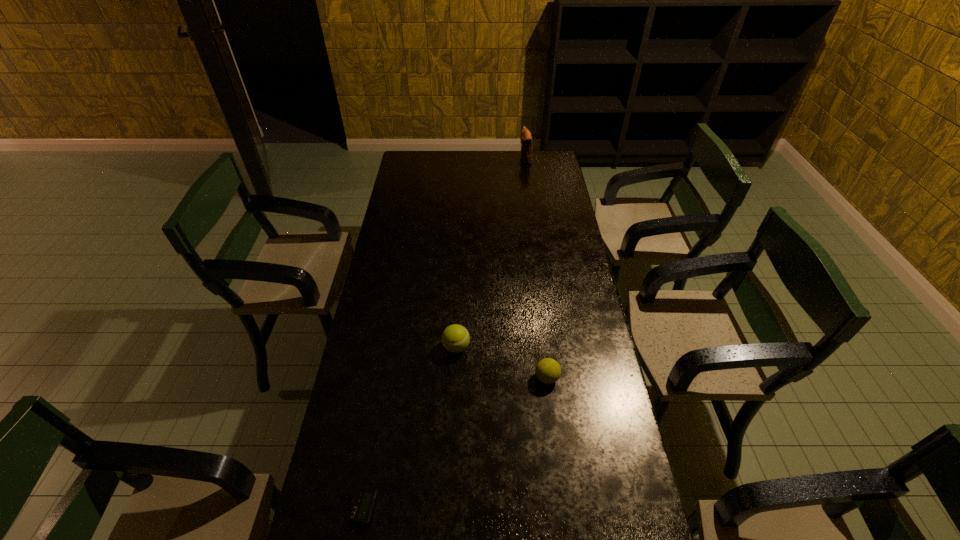
The height and width of the screenshot is (540, 960). What are the coordinates of `object that ranks as the closest to the right tennis ball` in the screenshot? It's located at click(x=455, y=338).

Locate which object is the closest to the leftmost object. Please provide its 2D coordinates. Your answer should be formatted as a tuple, i.e. [(x, y)], where the tuple contains the x and y coordinates of a point satisfying the conditions above.

[(455, 338)]

The width and height of the screenshot is (960, 540). Find the location of `blank space that satisfies the following two spatial constraints: 1. on the open side of the farthest object; 2. on the front side of the nearest object`. blank space that satisfies the following two spatial constraints: 1. on the open side of the farthest object; 2. on the front side of the nearest object is located at coordinates (574, 508).